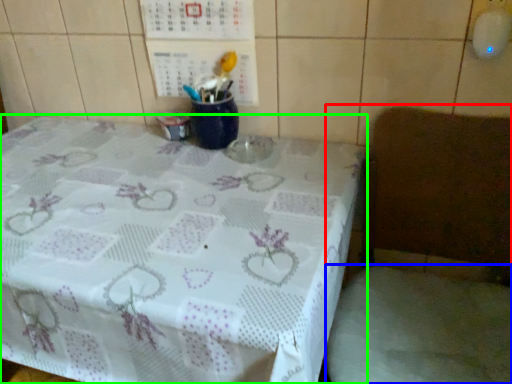
Question: Which is nearer to the chair (highlighted by a red box)? fabric (highlighted by a blue box) or table (highlighted by a green box).

Choices:
 (A) fabric
 (B) table

Answer: (A)